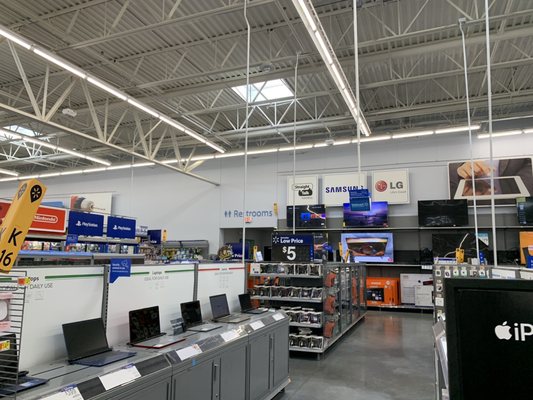
Image resolution: width=533 pixels, height=400 pixels. I want to click on sign for restrooms, so click(231, 211).